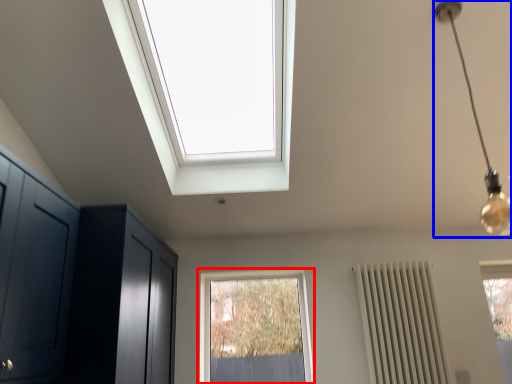
Question: Among these objects, which one is farthest to the camera, window (highlighted by a red box) or light fixture (highlighted by a blue box)?

Choices:
 (A) window
 (B) light fixture

Answer: (A)